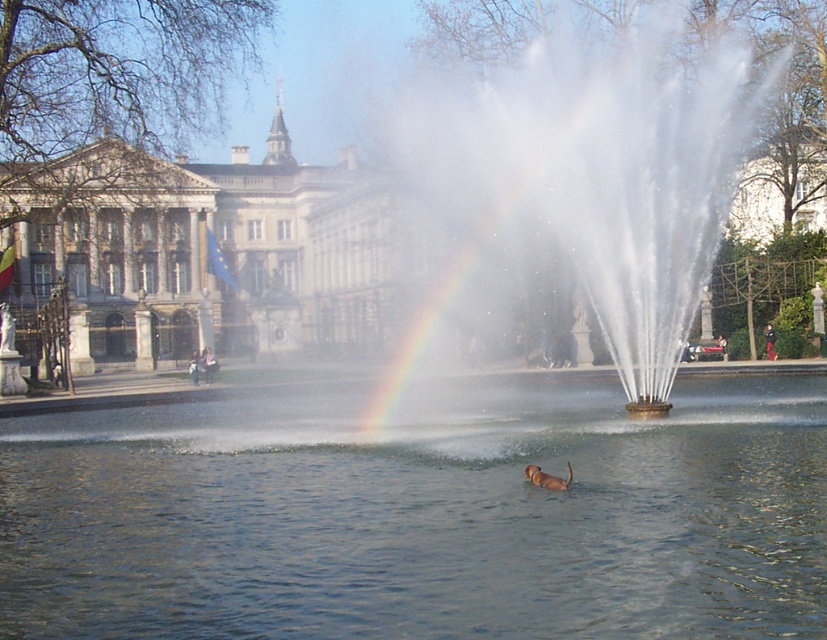
Does clear water at center appear over white water at center?

Actually, clear water at center is below white water at center.

Is point (484, 524) more distant than point (630, 157)?

No, (484, 524) is in front of (630, 157).

I want to click on clear water at center, so click(422, 516).

Does white water at center have a larger size compared to white stone building at upper left?

Actually, white water at center might be smaller than white stone building at upper left.

Is point (633, 204) farther from viewer compared to point (104, 348)?

That is False.

Find the location of `white water at center`. white water at center is located at coordinates (598, 161).

Can you confirm if clear water at center is shorter than white stone building at upper left?

Correct, clear water at center is not as tall as white stone building at upper left.

Which of these two, clear water at center or white stone building at upper left, stands shorter?

Standing shorter between the two is clear water at center.

Does point (471, 614) come closer to viewer compared to point (275, 292)?

Yes, point (471, 614) is closer to viewer.

This screenshot has width=827, height=640. What are the coordinates of `clear water at center` in the screenshot? It's located at [422, 516].